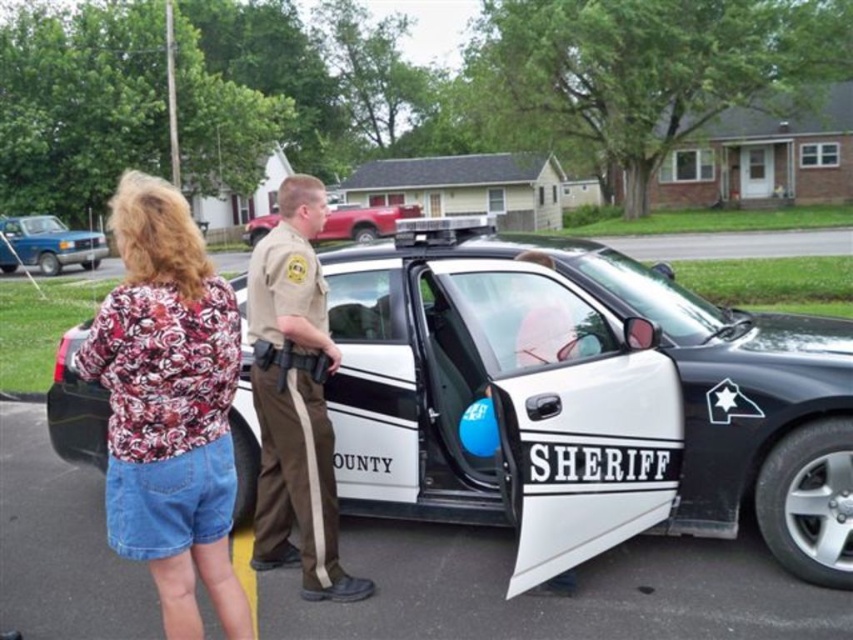
Question: Does white glossy sheriff car at center have a greater width compared to metallic red truck at center?

Choices:
 (A) yes
 (B) no

Answer: (B)

Question: Which point is closer to the camera?

Choices:
 (A) floral fabric blouse at upper left
 (B) white glossy sheriff car at center
 (C) tan uniform at center
 (D) metallic red truck at center

Answer: (A)

Question: Is white glossy sheriff car at center closer to camera compared to matte blue truck at left?

Choices:
 (A) no
 (B) yes

Answer: (B)

Question: Which point is closer to the camera?

Choices:
 (A) (210, 417)
 (B) (358, 221)
 (C) (15, 234)
 (D) (280, 516)

Answer: (A)

Question: Can you confirm if matte blue truck at left is bigger than metallic red truck at center?

Choices:
 (A) no
 (B) yes

Answer: (A)

Question: Which point appears closest to the camera in this image?

Choices:
 (A) (74, 228)
 (B) (360, 205)

Answer: (A)